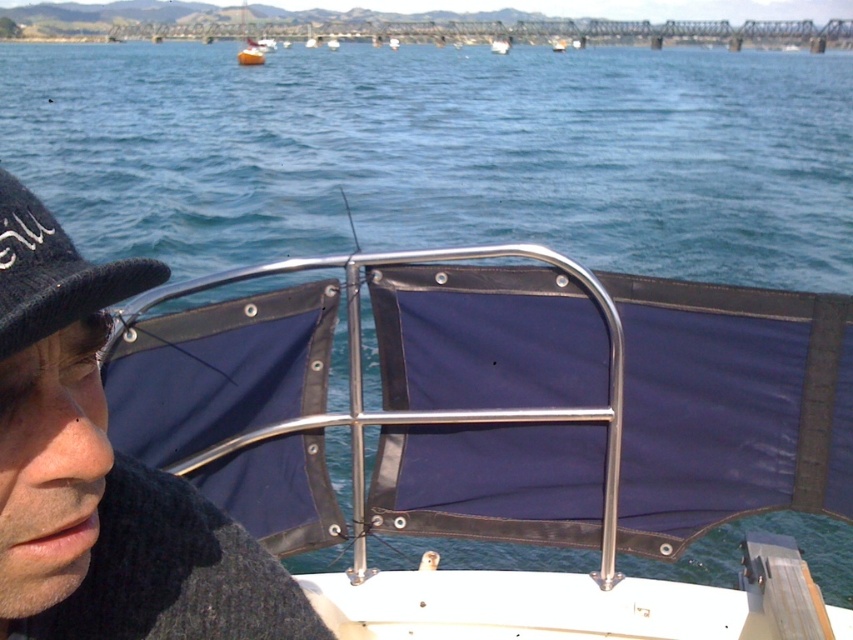
You are on a boat and need to place a black fabric baseball hat at left on the silver metallic rail at center. Will the hat fit on the rail?

The silver metallic rail at center might be wider than black fabric baseball hat at left, so it is possible that the hat will fit on the rail.

You are on a boat and want to know if the blue water at center is higher than the silver metallic rail at center. Can you confirm this based on the scene?

The blue water at center is much taller than the silver metallic rail at center according to the description.

You are on a boat and want to know if you can fit a 1 meter wide object between the blue water at center and the silver metallic rail at center. Can you determine if there is enough space?

The blue water at center is wider than the silver metallic rail at center, so there is enough space to fit a 1 meter wide object between them.